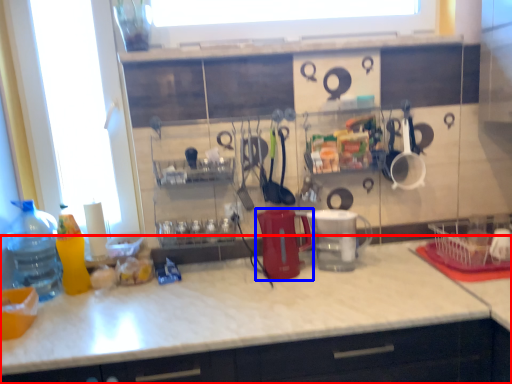
Question: Which object is closer to the camera taking this photo, countertop (highlighted by a red box) or appliance (highlighted by a blue box)?

Choices:
 (A) countertop
 (B) appliance

Answer: (A)